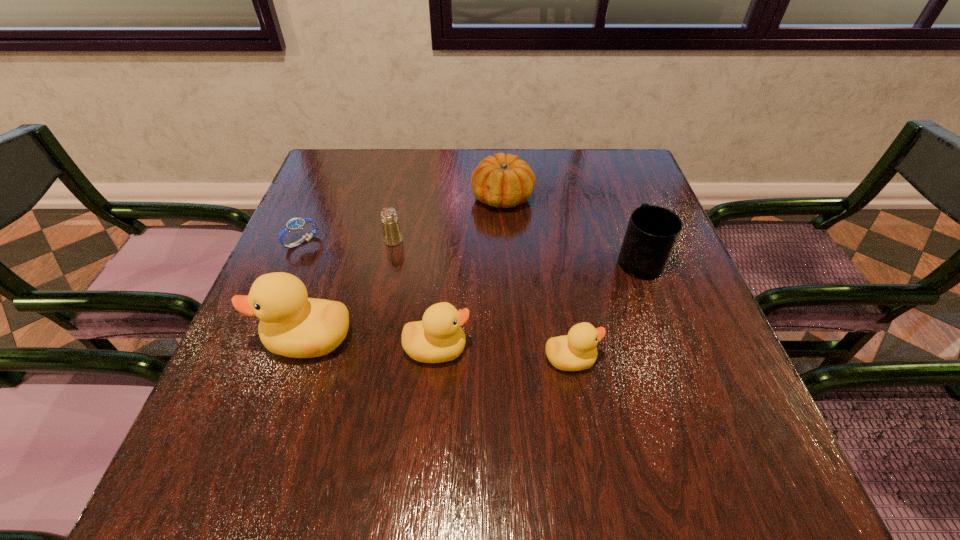
Locate an element on the screen. Image resolution: width=960 pixels, height=540 pixels. the tallest duckling is located at coordinates (291, 324).

The image size is (960, 540). Find the location of `the leftmost duckling`. the leftmost duckling is located at coordinates (291, 324).

At what (x,y) coordinates should I click in order to perform the action: click on the second tallest duckling. Please return your answer as a coordinate pair (x, y). Looking at the image, I should click on (438, 338).

Find the location of `the shortest duckling`. the shortest duckling is located at coordinates (576, 351).

Where is `saltshaker`? saltshaker is located at coordinates (392, 235).

Locate an element on the screen. This screenshot has height=540, width=960. gourd is located at coordinates (501, 180).

Where is `the rightmost object`? the rightmost object is located at coordinates (652, 232).

Find the location of a particular element. The width and height of the screenshot is (960, 540). the shortest object is located at coordinates (295, 224).

This screenshot has height=540, width=960. What are the coordinates of `free space located 0.280m on the face of the second tallest duckling` in the screenshot? It's located at (618, 349).

Locate an element on the screen. vacant space located on the face of the rightmost duckling is located at coordinates (647, 359).